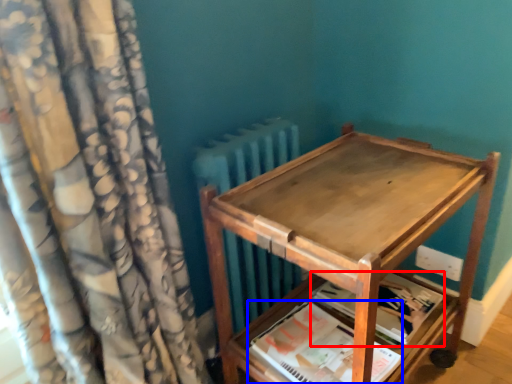
Question: Which point is closer to the camera, paperback book (highlighted by a red box) or paperback book (highlighted by a blue box)?

Choices:
 (A) paperback book
 (B) paperback book

Answer: (B)